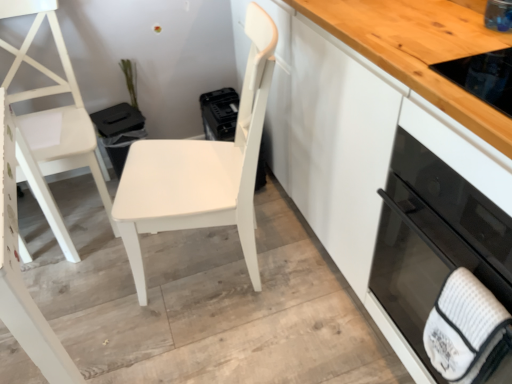
Question: From a real-world perspective, is black glass oven at right under white matte chair at center, the second chair from the left?

Choices:
 (A) no
 (B) yes

Answer: (A)

Question: Considering the relative sizes of black glass oven at right and white matte chair at center, the second chair from the left, in the image provided, is black glass oven at right smaller than white matte chair at center, the second chair from the left,?

Choices:
 (A) yes
 (B) no

Answer: (A)

Question: Can you confirm if black glass oven at right is taller than white matte chair at center, the second chair from the left?

Choices:
 (A) no
 (B) yes

Answer: (A)

Question: Is black glass oven at right facing towards white matte chair at center, the second chair from the left?

Choices:
 (A) yes
 (B) no

Answer: (B)

Question: Does black glass oven at right have a greater width compared to white matte chair at center, the second chair from the left?

Choices:
 (A) no
 (B) yes

Answer: (B)

Question: Is black glass oven at right placed right next to white matte chair at center, which ranks as the 1th chair in right-to-left order?

Choices:
 (A) yes
 (B) no

Answer: (B)

Question: From the image's perspective, is white matte chair at center, which ranks as the 1th chair in right-to-left order, over black glass oven at right?

Choices:
 (A) yes
 (B) no

Answer: (A)

Question: Can you confirm if white matte chair at center, the second chair from the left, is smaller than black glass oven at right?

Choices:
 (A) yes
 (B) no

Answer: (B)

Question: From the image's perspective, does white matte chair at center, the second chair from the left, appear lower than black glass oven at right?

Choices:
 (A) yes
 (B) no

Answer: (B)

Question: Is white matte chair at center, which ranks as the 1th chair in right-to-left order, oriented towards black glass oven at right?

Choices:
 (A) yes
 (B) no

Answer: (B)

Question: Is white matte chair at center, the second chair from the left, not inside black glass oven at right?

Choices:
 (A) no
 (B) yes

Answer: (B)

Question: Is white matte chair at center, which ranks as the 1th chair in right-to-left order, to the left of black glass oven at right from the viewer's perspective?

Choices:
 (A) no
 (B) yes

Answer: (B)

Question: Is white matte chair at left, which is the 2th chair in right-to-left order, looking in the opposite direction of white textured hand towel at lower right?

Choices:
 (A) no
 (B) yes

Answer: (A)